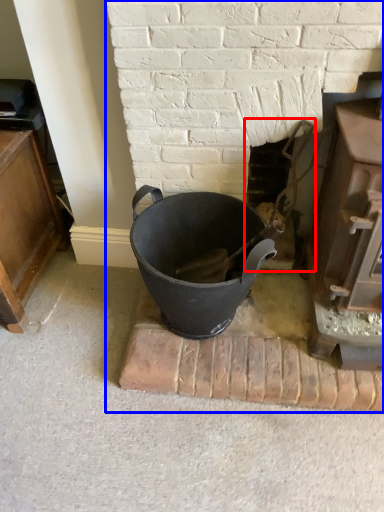
Question: Which object appears closest to the camera in this image, fireplace (highlighted by a red box) or fireplace (highlighted by a blue box)?

Choices:
 (A) fireplace
 (B) fireplace

Answer: (B)